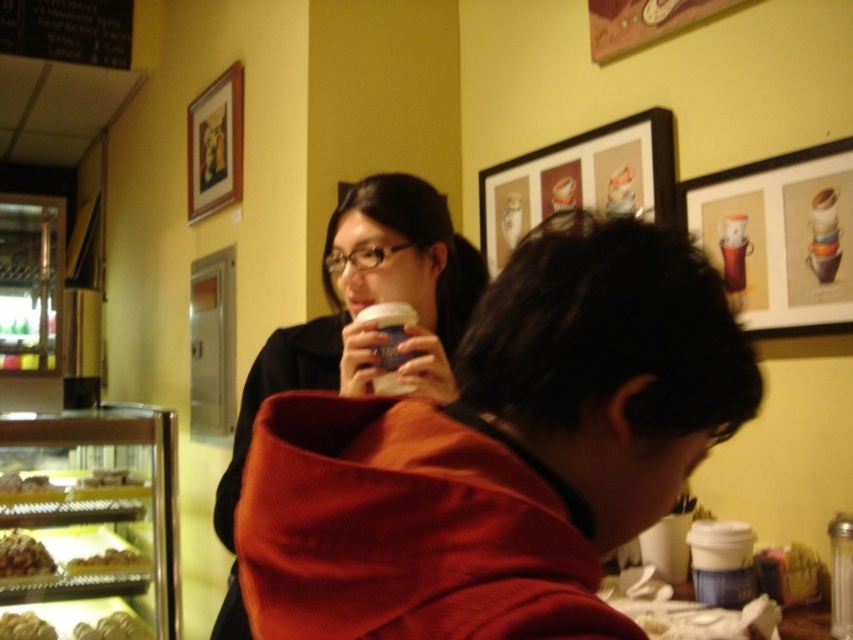
Question: Which point is closer to the camera?

Choices:
 (A) matte black coffee cup at upper center
 (B) golden textured pastry at lower left
 (C) crumbly brown pastry at lower left
 (D) smooth white cake at left

Answer: (A)

Question: Can you confirm if matte black coffee cup at upper center is positioned to the right of smooth brown pastry at lower left?

Choices:
 (A) yes
 (B) no

Answer: (A)

Question: From the image, what is the correct spatial relationship of matte black coffee cup at upper center in relation to smooth white cake at left?

Choices:
 (A) left
 (B) right

Answer: (B)

Question: Among these objects, which one is nearest to the camera?

Choices:
 (A) golden brown pastry at lower left
 (B) crumbly brown pastry at lower left

Answer: (B)

Question: Is matte red hoodie at center thinner than wooden frame at upper center?

Choices:
 (A) yes
 (B) no

Answer: (B)

Question: Which object is farther from the camera taking this photo?

Choices:
 (A) wooden frame at upper center
 (B) golden textured pastry at lower left
 (C) smooth brown pastry at lower left

Answer: (A)